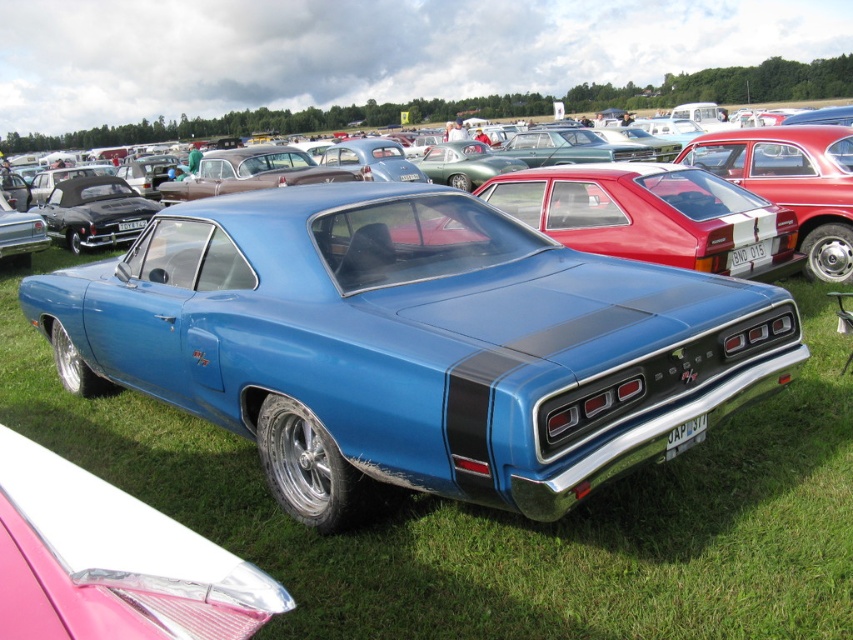
Question: Can you confirm if metallic blue muscle car at center is positioned to the right of metallic blue car at center?

Choices:
 (A) yes
 (B) no

Answer: (B)

Question: Where is metallic blue muscle car at center located in relation to metallic blue car at center in the image?

Choices:
 (A) below
 (B) above

Answer: (A)

Question: Which point is closer to the camera?

Choices:
 (A) metallic blue muscle car at center
 (B) metallic blue car at center

Answer: (A)

Question: Is metallic blue muscle car at center to the right of metallic blue car at center from the viewer's perspective?

Choices:
 (A) no
 (B) yes

Answer: (A)

Question: Which point is closer to the camera taking this photo?

Choices:
 (A) (764, 289)
 (B) (840, 200)

Answer: (A)